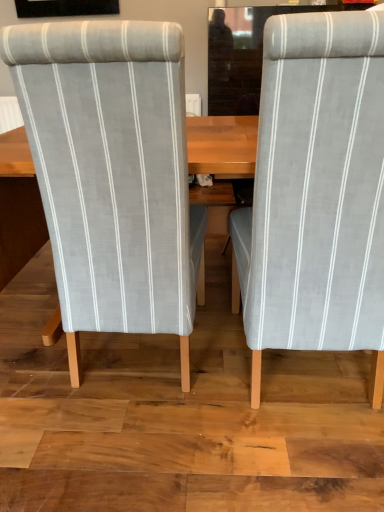
You are a GUI agent. You are given a task and a screenshot of the screen. Output one action in this format:
    pyautogui.click(x=<x>, y=<y>)
    Task: Click on the free space in front of gray fabric chair at right, the second chair positioned from the left
    The height and width of the screenshot is (512, 384).
    Given the screenshot: What is the action you would take?
    pyautogui.click(x=277, y=462)